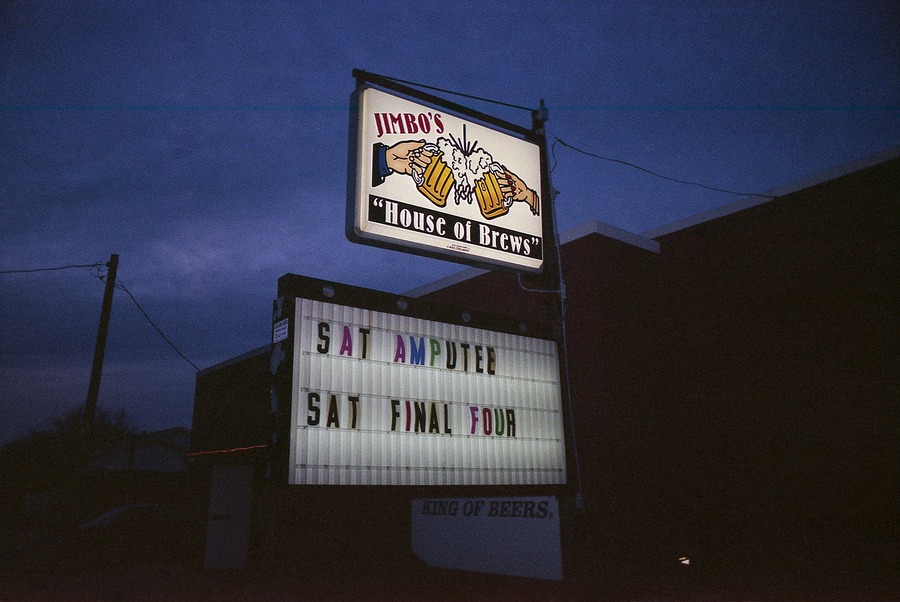
Find the location of a particular element. light up sign is located at coordinates (419, 395).